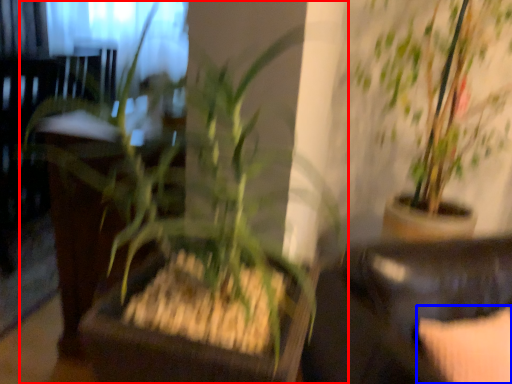
Question: Which point is closer to the camera, houseplant (highlighted by a red box) or pillow (highlighted by a blue box)?

Choices:
 (A) houseplant
 (B) pillow

Answer: (A)